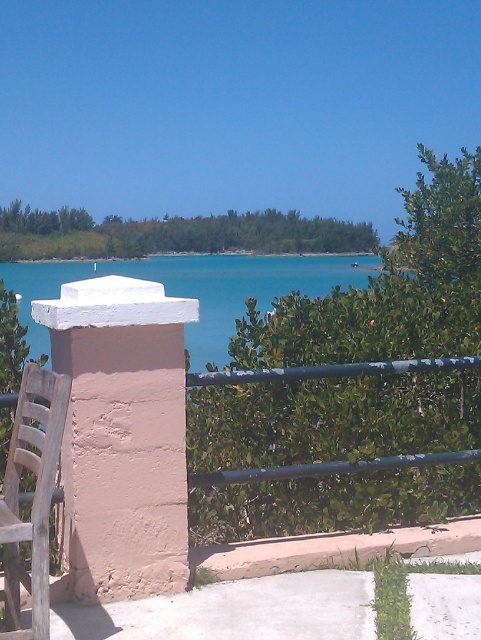
Which is above, teal water at center or wooden slats chair at lower left?

Positioned higher is teal water at center.

Is point (372, 268) positioned before point (16, 627)?

No, it is behind (16, 627).

What do you see at coordinates (195, 289) in the screenshot? I see `teal water at center` at bounding box center [195, 289].

At what (x,y) coordinates should I click in order to perform the action: click on teal water at center. Please return your answer as a coordinate pair (x, y). This screenshot has width=481, height=640. Looking at the image, I should click on (195, 289).